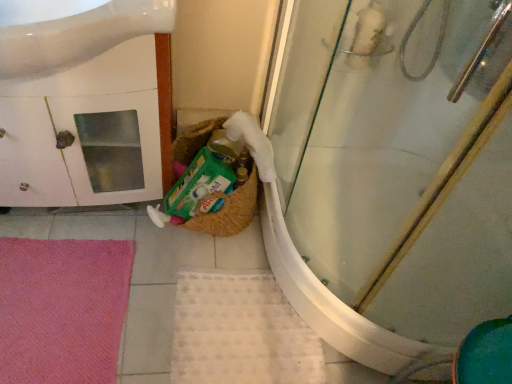
Question: Considering their positions, is white textured bath mat at lower center, which appears as the 1th bath mat when viewed from the right, located in front of or behind pink soft bath mat at lower left, which appears as the second bath mat when viewed from the right?

Choices:
 (A) front
 (B) behind

Answer: (B)

Question: Visually, is white textured bath mat at lower center, which appears as the 1th bath mat when viewed from the right, positioned to the left or to the right of pink soft bath mat at lower left, which is the 1th bath mat in left-to-right order?

Choices:
 (A) right
 (B) left

Answer: (A)

Question: Based on their relative distances, which object is farther from the white textured bath mat at lower center, which appears as the 1th bath mat when viewed from the right?

Choices:
 (A) transparent glass shower door at center
 (B) white glossy cabinet at left
 (C) white glossy sink at upper left
 (D) pink soft bath mat at lower left, which is the 1th bath mat in left-to-right order

Answer: (C)

Question: Estimate the real-world distances between objects in this image. Which object is farther from the pink soft bath mat at lower left, which is the 1th bath mat in left-to-right order?

Choices:
 (A) white glossy sink at upper left
 (B) white textured bath mat at lower center, which appears as the 1th bath mat when viewed from the right
 (C) transparent glass shower door at center
 (D) white glossy cabinet at left

Answer: (C)